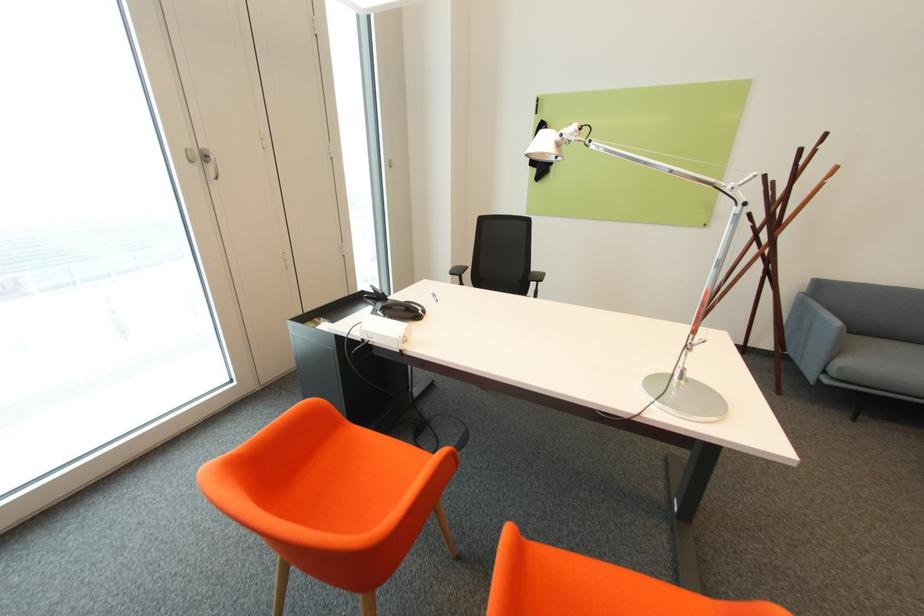
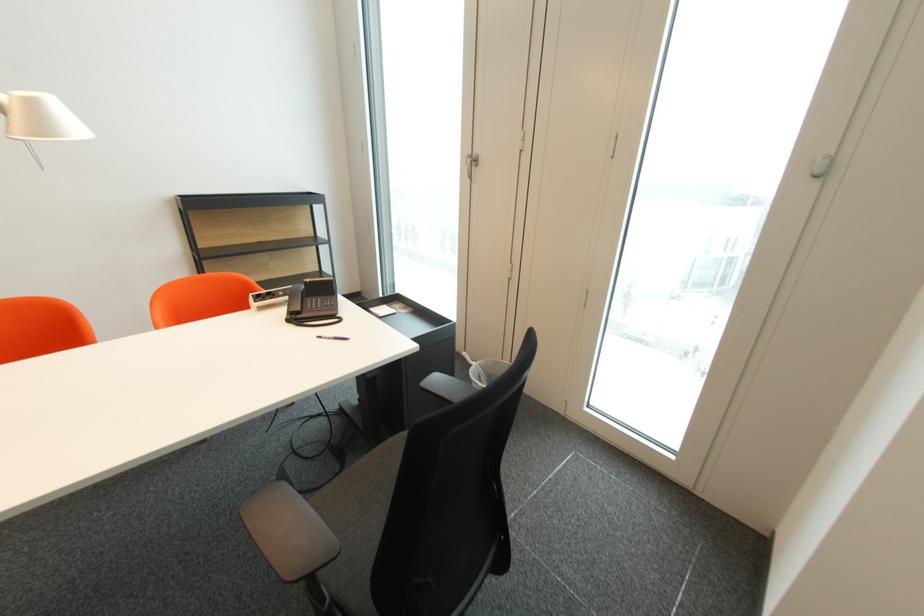
Find the pixel in the second image that matches pixel 496 456 in the first image.

(248, 500)